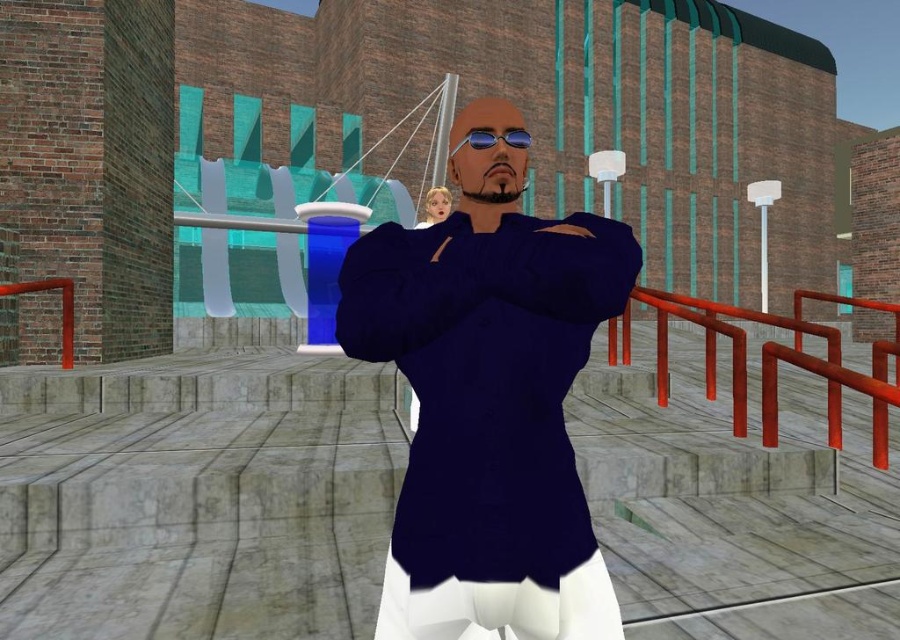
Based on the scene description, if you were standing at the position of the rubberized red railing at left, which direction would the navy blue shirt at center be located relative to you?

The navy blue shirt at center is to the right of the rubberized red railing at left, so if you were standing at the position of the rubberized red railing at left, the navy blue shirt at center would be located to your right side.

You are a character in the scene and want to look at the blue reflective lenses at center without moving your head. Which direction should you look relative to the rubberized red railing at left?

Since the rubberized red railing at left is below the blue reflective lenses at center, you should look upwards from the rubberized red railing at left to see the blue reflective lenses at center.